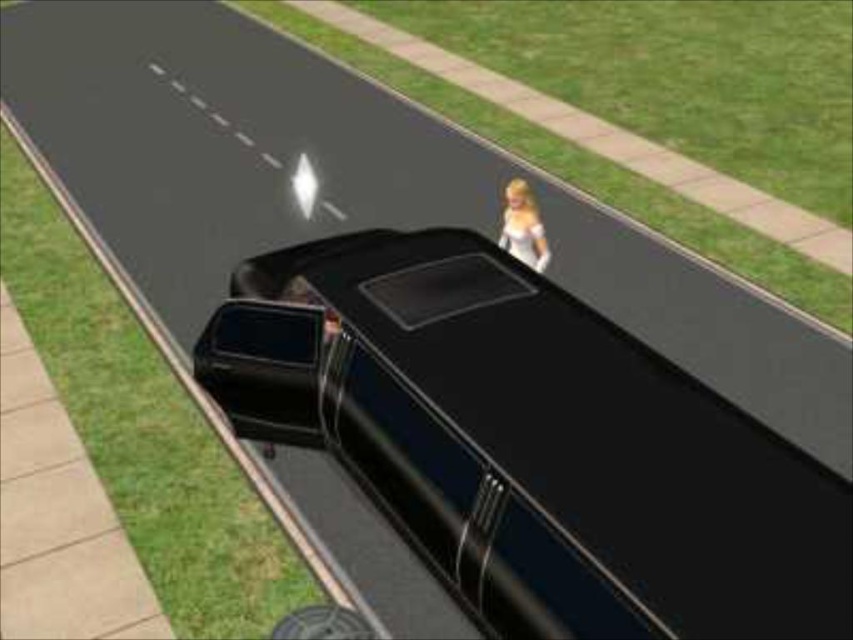
Question: Can you confirm if glossy black car at center is positioned above blonde hair doll at center?

Choices:
 (A) yes
 (B) no

Answer: (B)

Question: Is glossy black car at center thinner than blonde hair doll at center?

Choices:
 (A) no
 (B) yes

Answer: (A)

Question: Which point appears farthest from the camera in this image?

Choices:
 (A) (529, 236)
 (B) (718, 465)

Answer: (A)

Question: From the image, what is the correct spatial relationship of glossy black car at center in relation to blonde hair doll at center?

Choices:
 (A) right
 (B) left

Answer: (B)